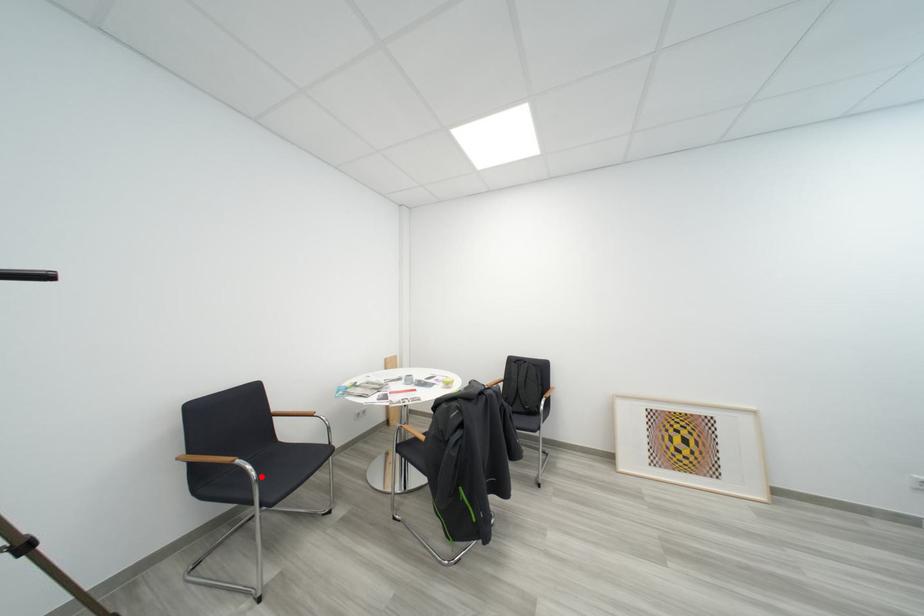
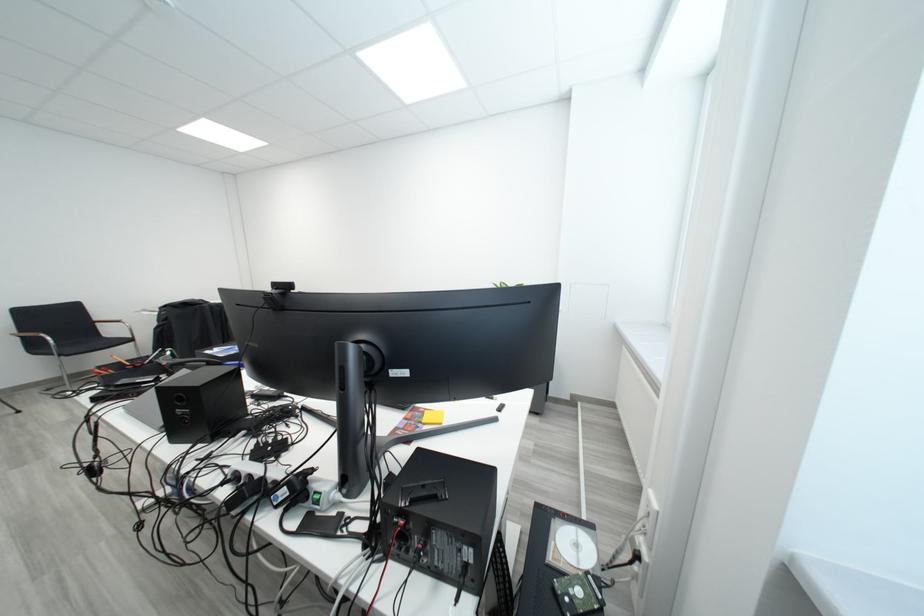
Question: A red point is marked in image1. In image2, is the corresponding 3D point closer to the camera or farther? Reply with the corresponding letter.

Choices:
 (A) The corresponding 3D point is closer.
 (B) The corresponding 3D point is farther.

Answer: (B)